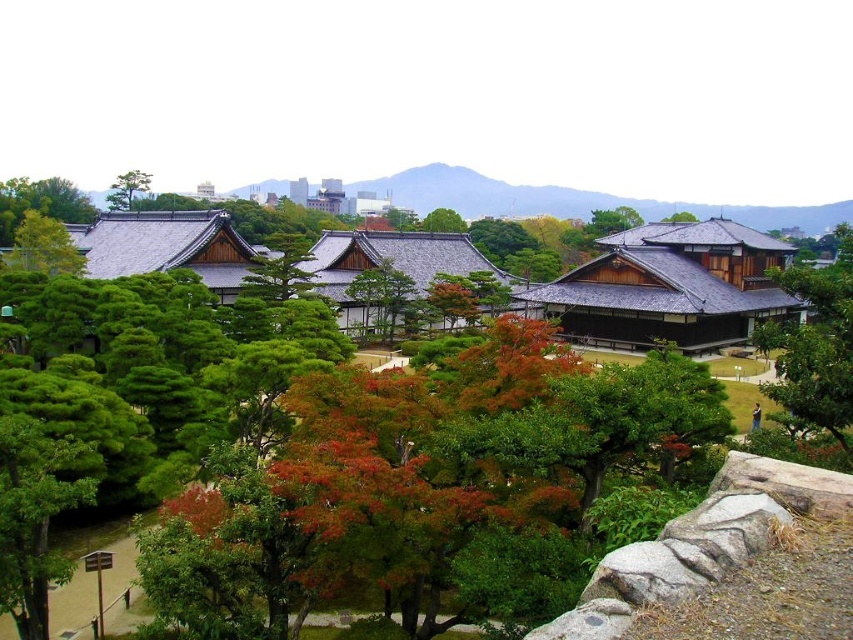
Can you confirm if green matte tree at center is positioned to the left of green matte tree at upper center?

Yes, green matte tree at center is to the left of green matte tree at upper center.

Can you confirm if green matte tree at center is positioned below green matte tree at upper center?

No, green matte tree at center is not below green matte tree at upper center.

Image resolution: width=853 pixels, height=640 pixels. Identify the location of green matte tree at center. (442, 221).

This screenshot has width=853, height=640. Find the location of `green matte tree at center`. green matte tree at center is located at coordinates (442, 221).

Who is taller, green matte tree at upper left or green matte tree at center?

green matte tree at upper left is taller.

Does green matte tree at upper left appear on the left side of green matte tree at center?

Indeed, green matte tree at upper left is positioned on the left side of green matte tree at center.

You are a GUI agent. You are given a task and a screenshot of the screen. Output one action in this format:
    pyautogui.click(x=<x>, y=<y>)
    Task: Click on the green matte tree at upper left
    The height and width of the screenshot is (640, 853).
    Given the screenshot: What is the action you would take?
    pyautogui.click(x=126, y=188)

Locate an element on the screen. Image resolution: width=853 pixels, height=640 pixels. green matte tree at upper left is located at coordinates (126, 188).

Is green leafy tree at right positioned in front of green matte tree at upper center?

Yes, green leafy tree at right is in front of green matte tree at upper center.

Find the location of a particular element. green leafy tree at right is located at coordinates (815, 342).

The height and width of the screenshot is (640, 853). Identify the location of green leafy tree at right. [x=815, y=342].